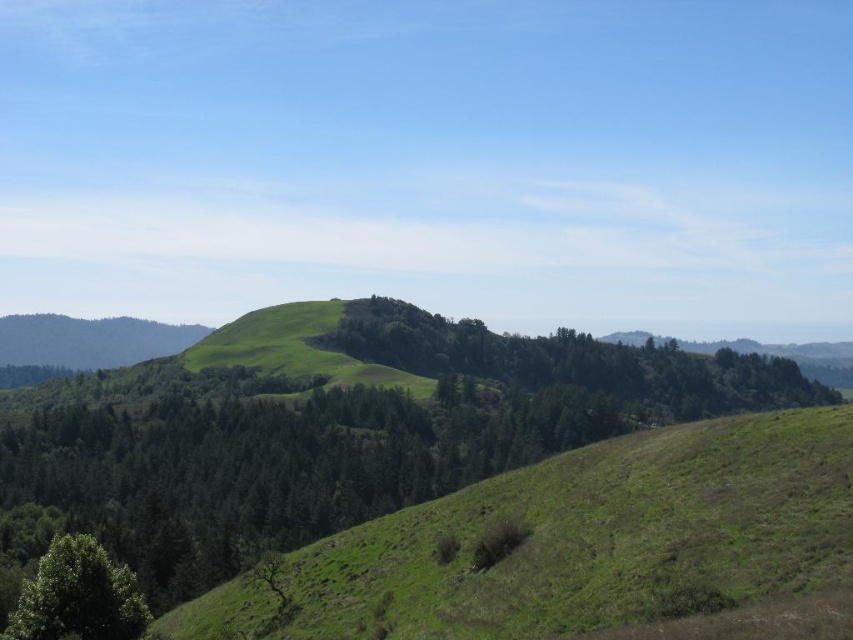
You are standing at the base of the green leafy tree at lower left and want to climb to the top of the green leafy tree at center. Considering their heights, can you reach the top of the center tree from the top of the lower left tree without climbing further?

The green leafy tree at center is much taller than the green leafy tree at lower left. Therefore, even if you climb to the top of the green leafy tree at lower left, you will still need to climb higher to reach the top of the green leafy tree at center.